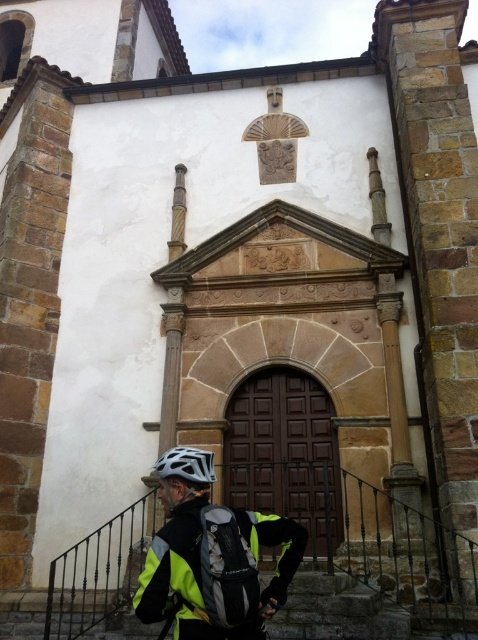
You are a delivery person standing at the front of the historic building. You need to place a package on the ground between the yellow reflective jacket at lower center and the white matte bicycle helmet at lower center. What is the minimum distance you need to walk to ensure the package is placed between them?

The minimum distance you need to walk is 2.81 meters, which is the distance between the yellow reflective jacket at lower center and the white matte bicycle helmet at lower center.

You are a delivery person who needs to place both the yellow reflective jacket at lower center and the white matte bicycle helmet at lower center into a storage compartment. The compartment has a divider that separates items into two sections. If you want to maintain their original spatial arrangement from the image, which item should you place on the right side of the divider?

The yellow reflective jacket at lower center should be placed on the right side of the divider because in the image, it is positioned on the right side of the white matte bicycle helmet at lower center.

From the picture: You are a delivery person standing in front of the historic building. You need to quickly access your yellow reflective jacket at lower center and your white matte bicycle helmet at lower center. Which item is easier to reach without moving your current position?

The yellow reflective jacket at lower center is easier to reach because it is in front of the white matte bicycle helmet at lower center, making it closer to your current position.